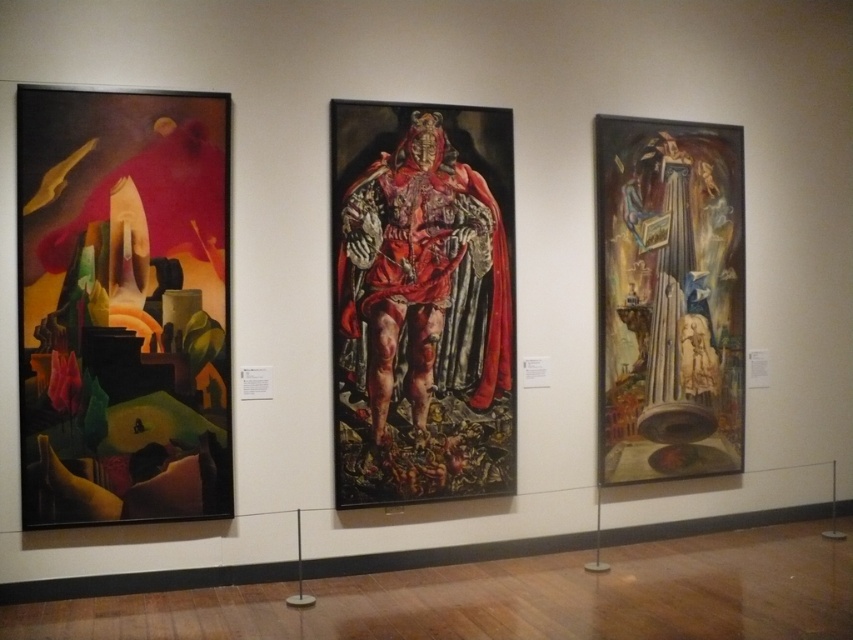
You are an art curator arranging the gallery wall. The abstract painting at left and the red velvet cape at center are part of the exhibition. Based on their widths, which object should be placed closer to the entrance to ensure proper spacing between them?

The abstract painting at left has a lesser width compared to the red velvet cape at center. To ensure proper spacing, the narrower abstract painting at left should be placed closer to the entrance, allowing the wider red velvet cape at center to have adequate space behind it.

You are an art curator who needs to move a sculpture that is 3.5 feet wide into the space between the abstract painting at left and the red velvet cape at center. Is there enough space for the sculpture?

The abstract painting at left and red velvet cape at center are 3.85 feet apart, so yes, the sculpture can fit between them since its width is 3.5 feet, which is less than the available space.